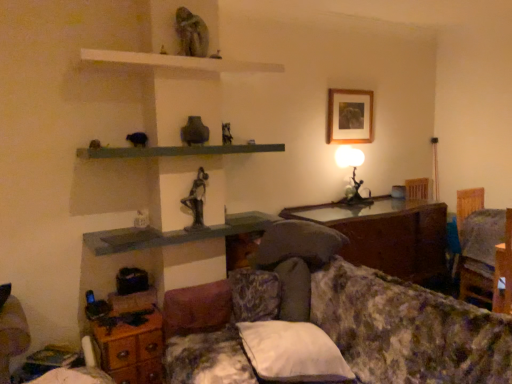
What do you see at coordinates (174, 234) in the screenshot?
I see `matte gray shelf at center, positioned as the 1th shelf in bottom-to-top order` at bounding box center [174, 234].

This screenshot has height=384, width=512. I want to click on velvet purple swivel chair at right, so click(x=480, y=253).

Measure the distance between point (419, 229) and camera.

A distance of 11.24 feet exists between point (419, 229) and camera.

Measure the distance between green matte shelf at center, acting as the second shelf starting from the bottom, and camera.

green matte shelf at center, acting as the second shelf starting from the bottom, is 2.23 meters from camera.

Where is `wooden picture frame at upper center`? wooden picture frame at upper center is located at coordinates (350, 116).

You are a GUI agent. You are given a task and a screenshot of the screen. Output one action in this format:
    pyautogui.click(x=<x>, y=<y>)
    Task: Click on the floral fabric couch at lower right
    The height and width of the screenshot is (384, 512).
    Given the screenshot: What is the action you would take?
    pyautogui.click(x=408, y=330)

Could you measure the distance between green matte shelf at center, acting as the second shelf starting from the bottom, and metallic silver table lamp at upper right?

green matte shelf at center, acting as the second shelf starting from the bottom, and metallic silver table lamp at upper right are 1.26 meters apart from each other.

Can you confirm if green matte shelf at center, placed as the second shelf when sorted from top to bottom, is bigger than metallic silver table lamp at upper right?

Yes.

Is green matte shelf at center, acting as the second shelf starting from the bottom, far away from metallic silver table lamp at upper right?

Absolutely, green matte shelf at center, acting as the second shelf starting from the bottom, is distant from metallic silver table lamp at upper right.

Is point (205, 147) positioned behind point (351, 189)?

That is False.

Is metallic silver table lamp at upper right situated inside green matte shelf at center, placed as the second shelf when sorted from top to bottom, or outside?

metallic silver table lamp at upper right lies outside green matte shelf at center, placed as the second shelf when sorted from top to bottom.

Considering the sizes of objects metallic silver table lamp at upper right and green matte shelf at center, placed as the second shelf when sorted from top to bottom, in the image provided, who is wider, metallic silver table lamp at upper right or green matte shelf at center, placed as the second shelf when sorted from top to bottom,?

green matte shelf at center, placed as the second shelf when sorted from top to bottom, is wider.

Is green matte shelf at center, acting as the second shelf starting from the bottom, at the back of metallic silver table lamp at upper right?

That's not correct — metallic silver table lamp at upper right is not looking away from green matte shelf at center, acting as the second shelf starting from the bottom.

Can we say green matte shelf at center, acting as the second shelf starting from the bottom, lies outside floral fabric couch at lower right?

Indeed, green matte shelf at center, acting as the second shelf starting from the bottom, is completely outside floral fabric couch at lower right.

Who is bigger, green matte shelf at center, placed as the second shelf when sorted from top to bottom, or floral fabric couch at lower right?

floral fabric couch at lower right is bigger.

Is green matte shelf at center, acting as the second shelf starting from the bottom, with floral fabric couch at lower right?

green matte shelf at center, acting as the second shelf starting from the bottom, and floral fabric couch at lower right are not in contact.

From the image's perspective, which one is positioned lower, white soft pillow at lower center or green matte shelf at center, placed as the second shelf when sorted from top to bottom?

white soft pillow at lower center, from the image's perspective.

Which of these two, white soft pillow at lower center or green matte shelf at center, placed as the second shelf when sorted from top to bottom, is thinner?

Thinner between the two is green matte shelf at center, placed as the second shelf when sorted from top to bottom.

In the image, is white soft pillow at lower center on the left side or the right side of green matte shelf at center, acting as the second shelf starting from the bottom?

Based on their positions, white soft pillow at lower center is located to the right of green matte shelf at center, acting as the second shelf starting from the bottom.

Can you confirm if white soft pillow at lower center is shorter than green matte shelf at center, acting as the second shelf starting from the bottom?

No.

Which is nearer, (357, 118) or (433, 270)?

Point (357, 118) is farther from the camera than point (433, 270).

Is wooden picture frame at upper center facing towards wooden glossy table at center?

No, wooden picture frame at upper center is not aimed at wooden glossy table at center.

Considering the relative sizes of wooden picture frame at upper center and wooden glossy table at center in the image provided, is wooden picture frame at upper center thinner than wooden glossy table at center?

Yes, wooden picture frame at upper center is thinner than wooden glossy table at center.

From the image's perspective, does velvet purple swivel chair at right appear lower than matte gray shelf at center, positioned as the 1th shelf in bottom-to-top order?

Yes, from the image's perspective, velvet purple swivel chair at right is beneath matte gray shelf at center, positioned as the 1th shelf in bottom-to-top order.

Is velvet purple swivel chair at right aimed at matte gray shelf at center, the 3th shelf from the top?

No, velvet purple swivel chair at right is not aimed at matte gray shelf at center, the 3th shelf from the top.

Looking at this image, is velvet purple swivel chair at right positioned in front of matte gray shelf at center, the 3th shelf from the top?

No, velvet purple swivel chair at right is further to the viewer.

Which is more to the right, velvet purple swivel chair at right or matte gray shelf at center, positioned as the 1th shelf in bottom-to-top order?

Positioned to the right is velvet purple swivel chair at right.

Which is correct: floral fabric couch at lower right is inside green matte shelf at center, placed as the second shelf when sorted from top to bottom, or outside of it?

floral fabric couch at lower right lies outside green matte shelf at center, placed as the second shelf when sorted from top to bottom.

Would you say floral fabric couch at lower right is to the left or to the right of green matte shelf at center, placed as the second shelf when sorted from top to bottom, in the picture?

Clearly, floral fabric couch at lower right is on the right of green matte shelf at center, placed as the second shelf when sorted from top to bottom, in the image.

Which of these two, floral fabric couch at lower right or green matte shelf at center, placed as the second shelf when sorted from top to bottom, is smaller?

Smaller between the two is green matte shelf at center, placed as the second shelf when sorted from top to bottom.

Who is shorter, floral fabric couch at lower right or green matte shelf at center, placed as the second shelf when sorted from top to bottom?

green matte shelf at center, placed as the second shelf when sorted from top to bottom, is shorter.

At what (x,y) coordinates should I click in order to perform the action: click on table lamp that is on the right side of green matte shelf at center, placed as the second shelf when sorted from top to bottom. Please return your answer as a coordinate pair (x, y). Looking at the image, I should click on (352, 174).

Where is `the 1st shelf positioned above the metallic silver table lamp at upper right (from a real-world perspective)`? The image size is (512, 384). the 1st shelf positioned above the metallic silver table lamp at upper right (from a real-world perspective) is located at coordinates (176, 151).

Estimate the real-world distances between objects in this image. Which object is closer to white soft pillow at lower center, white matte shelf at upper center, acting as the third shelf starting from the bottom, or wooden dresser at lower left?

wooden dresser at lower left is positioned closer to the anchor white soft pillow at lower center.

Based on their spatial positions, is bronze statue at center or velvet purple swivel chair at right closer to wooden dresser at lower left?

bronze statue at center lies closer to wooden dresser at lower left than the other object.

Based on their spatial positions, is white soft pillow at lower center or wooden glossy table at center closer to bronze statue at center?

Among the two, white soft pillow at lower center is located nearer to bronze statue at center.

From the image, which object appears to be nearer to wooden picture frame at upper center, floral fabric couch at lower right or wooden dresser at lower left?

Based on the image, floral fabric couch at lower right appears to be nearer to wooden picture frame at upper center.

Looking at the image, which one is located closer to wooden glossy table at center, white soft pillow at lower center or bronze statue at center?

white soft pillow at lower center.

From the image, which object appears to be nearer to wooden picture frame at upper center, wooden glossy table at center or bronze statue at center?

Based on the image, wooden glossy table at center appears to be nearer to wooden picture frame at upper center.

Based on the photo, based on their spatial positions, is wooden glossy table at center or white matte shelf at upper center, acting as the third shelf starting from the bottom, closer to metallic silver table lamp at upper right?

Based on the image, wooden glossy table at center appears to be nearer to metallic silver table lamp at upper right.

Estimate the real-world distances between objects in this image. Which object is closer to matte gray shelf at center, the 3th shelf from the top, green matte shelf at center, acting as the second shelf starting from the bottom, or wooden glossy table at center?

green matte shelf at center, acting as the second shelf starting from the bottom, is positioned closer to the anchor matte gray shelf at center, the 3th shelf from the top.

Find the location of a particular element. This screenshot has height=384, width=512. sculpture between white matte shelf at upper center, arranged as the first shelf when viewed from the top, and matte gray shelf at center, the 3th shelf from the top, in the up-down direction is located at coordinates (197, 200).

Find the location of a particular element. picture frame that lies between white matte shelf at upper center, acting as the third shelf starting from the bottom, and wooden dresser at lower left from top to bottom is located at coordinates (350, 116).

I want to click on sculpture that lies between green matte shelf at center, placed as the second shelf when sorted from top to bottom, and wooden dresser at lower left from top to bottom, so click(197, 200).

Image resolution: width=512 pixels, height=384 pixels. I want to click on pillow between floral fabric couch at lower right and wooden dresser at lower left along the z-axis, so click(292, 352).